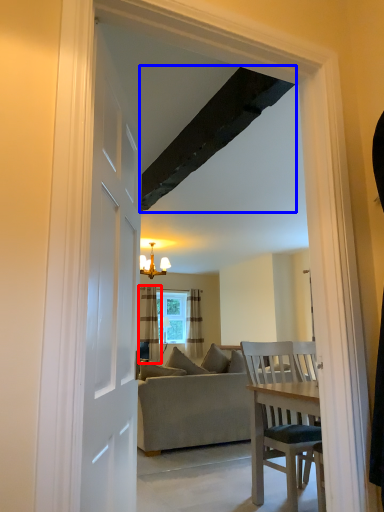
Question: Among these objects, which one is farthest to the camera, curtain (highlighted by a red box) or exhaust hood (highlighted by a blue box)?

Choices:
 (A) curtain
 (B) exhaust hood

Answer: (A)